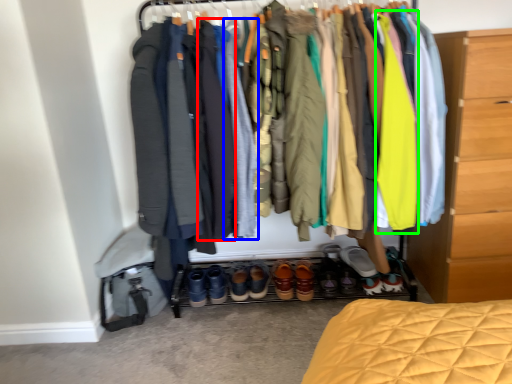
Question: Which is nearer to the robe (highlighted by a red box)? robe (highlighted by a blue box) or garment (highlighted by a green box).

Choices:
 (A) robe
 (B) garment

Answer: (A)